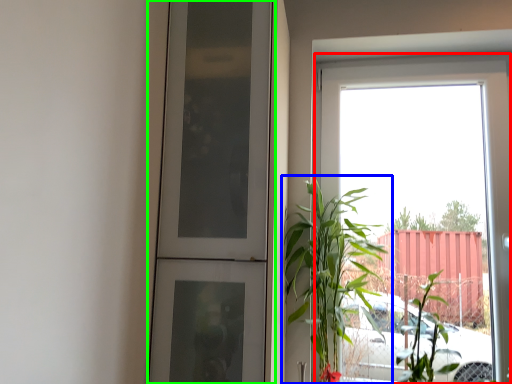
Question: Which is nearer to the window (highlighted by a red box)? houseplant (highlighted by a blue box) or door (highlighted by a green box).

Choices:
 (A) houseplant
 (B) door

Answer: (A)